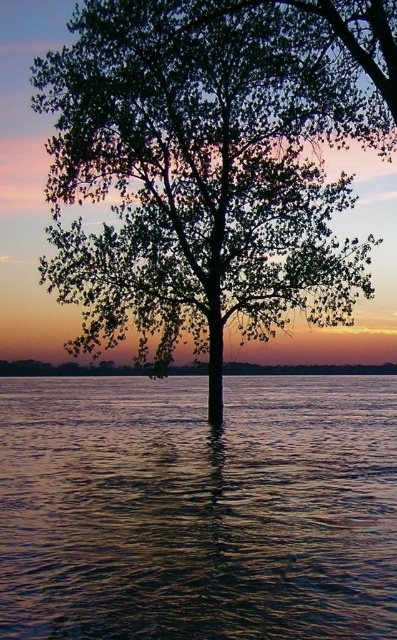
Is point (71, 193) positioned after point (82, 435)?

Yes, point (71, 193) is farther from viewer.

Which is more to the left, green leafy tree at center or translucent water at center?

From the viewer's perspective, translucent water at center appears more on the left side.

Is point (138, 200) closer to viewer compared to point (80, 422)?

That is True.

You are a GUI agent. You are given a task and a screenshot of the screen. Output one action in this format:
    pyautogui.click(x=<x>, y=<y>)
    Task: Click on the green leafy tree at center
    This screenshot has width=397, height=640.
    Given the screenshot: What is the action you would take?
    pyautogui.click(x=213, y=163)